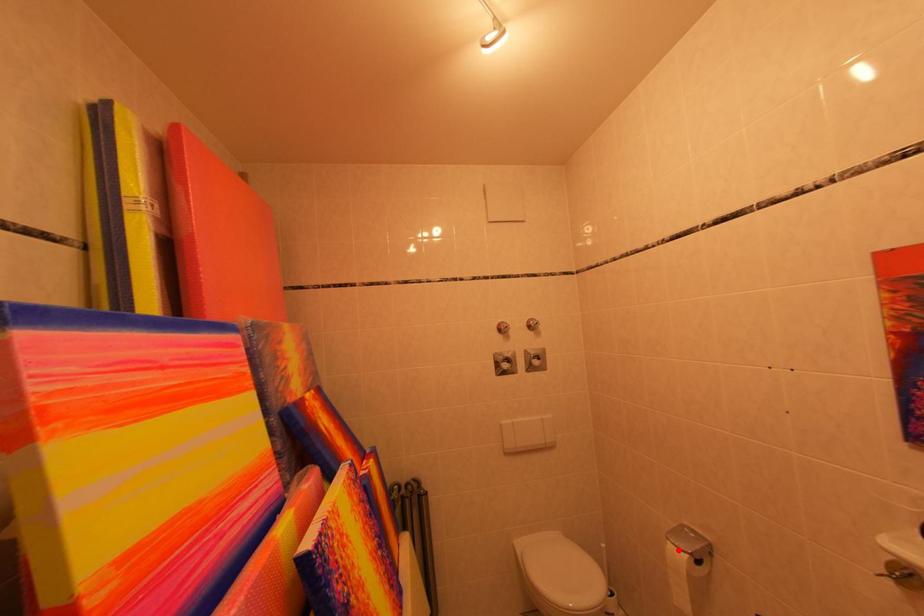
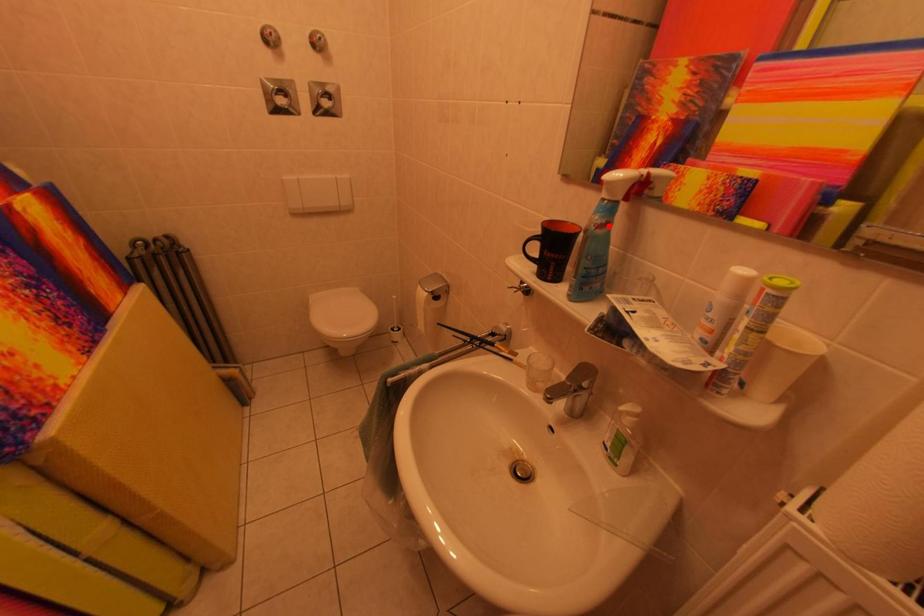
I am providing you with two images of the same scene from different viewpoints. A red point is marked on the first image and another point is marked on the second image. Do the highlighted points in image1 and image2 indicate the same real-world spot?

No